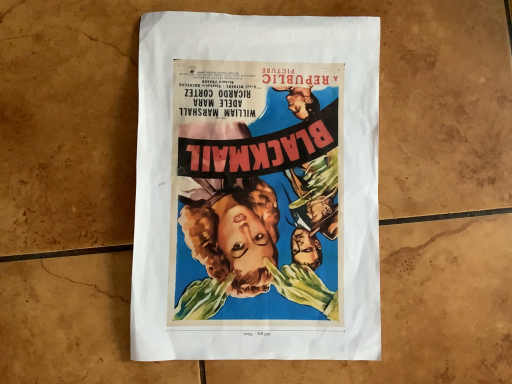
You are a GUI agent. You are given a task and a screenshot of the screen. Output one action in this format:
    pyautogui.click(x=<x>, y=<y>)
    Task: Click on the vacant point above vibrant paper poster at center (from a real-world perspective)
    This screenshot has height=384, width=512.
    Given the screenshot: What is the action you would take?
    pyautogui.click(x=261, y=175)